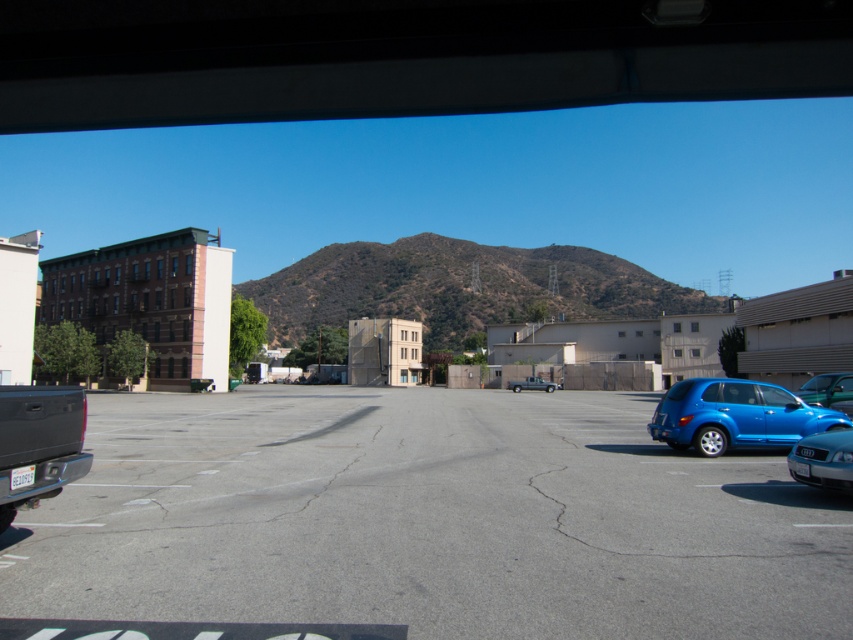
Does asphalt at center appear under blue matte car at lower right?

Yes, asphalt at center is below blue matte car at lower right.

Is point (280, 554) in front of point (711, 378)?

Yes, it is.

Where is `asphalt at center`? asphalt at center is located at coordinates (425, 522).

Who is positioned more to the right, matte black truck at lower left or silver metallic sedan at lower right?

silver metallic sedan at lower right is more to the right.

Does point (70, 444) lie behind point (840, 490)?

No, it is not.

Where is `matte black truck at lower left`? Image resolution: width=853 pixels, height=640 pixels. matte black truck at lower left is located at coordinates 39,444.

Who is higher up, blue matte car at lower right or matte black truck at lower left?

matte black truck at lower left

Which is below, blue matte car at lower right or matte black truck at lower left?

blue matte car at lower right is lower down.

Who is more forward, (701, 436) or (1, 460)?

Answer: Point (1, 460) is more forward.

Locate an element on the screen. The height and width of the screenshot is (640, 853). blue matte car at lower right is located at coordinates (735, 416).